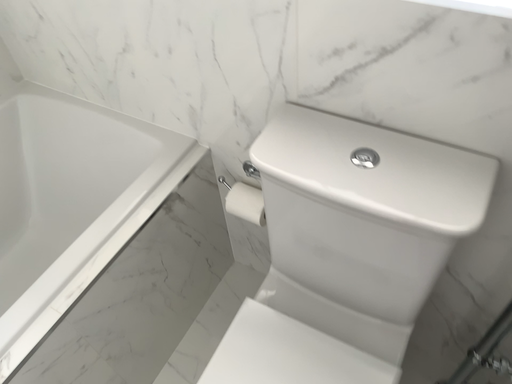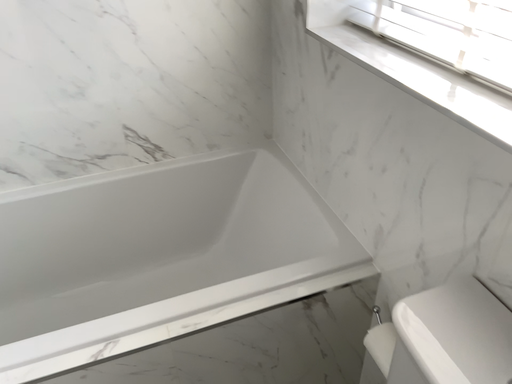
Question: How did the camera likely rotate when shooting the video?

Choices:
 (A) rotated upward
 (B) rotated downward

Answer: (A)